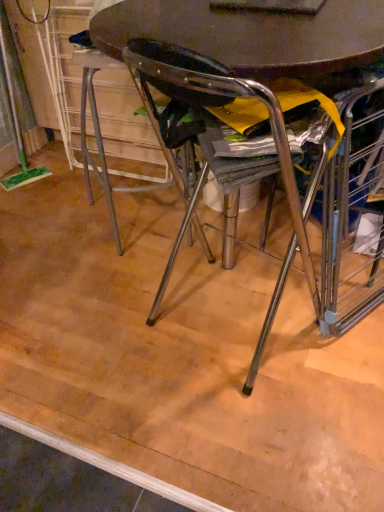
Locate an element on the screen. vacant area to the left of metallic brown table at center is located at coordinates (83, 352).